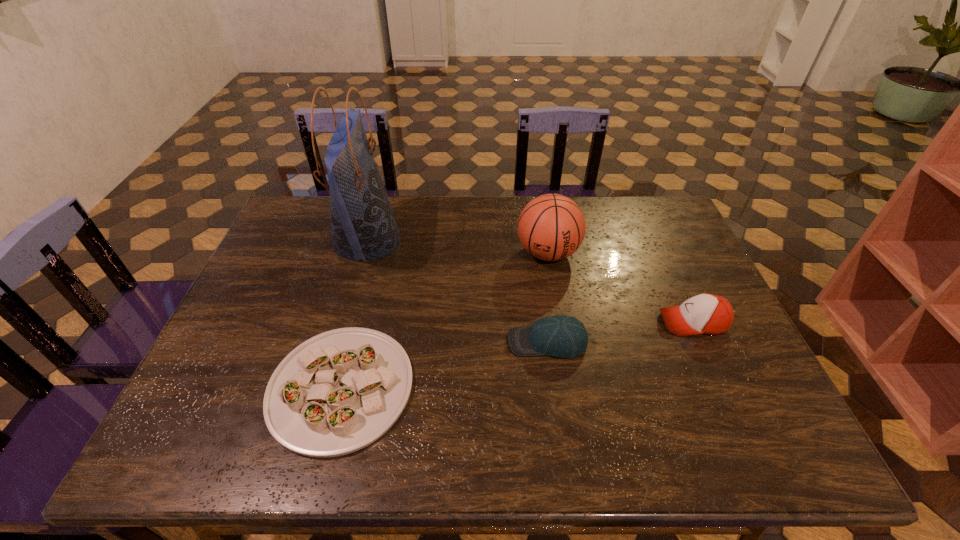
The image size is (960, 540). In order to click on free location located on the front-facing side of the right baseball cap in this screenshot , I will do `click(636, 322)`.

The image size is (960, 540). I want to click on vacant space situated on the front-facing side of the right baseball cap, so coord(513,322).

The width and height of the screenshot is (960, 540). What are the coordinates of `free spot located on the front of the second shortest object` in the screenshot? It's located at (554, 393).

Locate an element on the screen. Image resolution: width=960 pixels, height=540 pixels. vacant space located 0.080m on the left of the shortest object is located at coordinates (235, 388).

Where is `shopping bag that is at the far edge`? shopping bag that is at the far edge is located at coordinates (363, 226).

The height and width of the screenshot is (540, 960). Find the location of `basketball that is positioned at the far edge`. basketball that is positioned at the far edge is located at coordinates (551, 227).

Image resolution: width=960 pixels, height=540 pixels. Identify the location of object at the near edge. [x=339, y=391].

Find the location of `object that is at the right edge`. object that is at the right edge is located at coordinates (709, 314).

Where is `free space at the far edge of the desktop`? Image resolution: width=960 pixels, height=540 pixels. free space at the far edge of the desktop is located at coordinates (622, 211).

You are a GUI agent. You are given a task and a screenshot of the screen. Output one action in this format:
    pyautogui.click(x=<x>, y=<y>)
    Task: Click on the vacant space at the near edge of the desktop
    
    Given the screenshot: What is the action you would take?
    pyautogui.click(x=448, y=435)